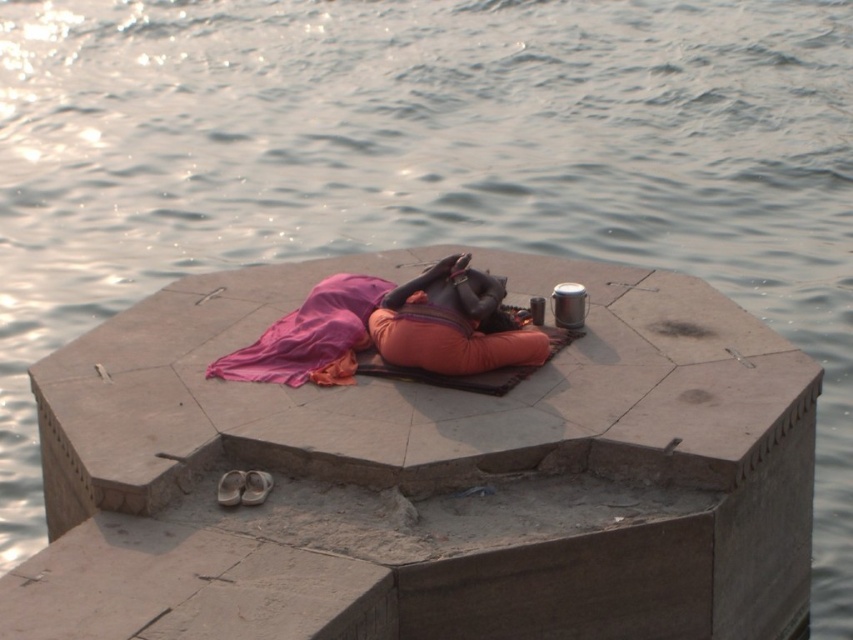
Question: Where is orange fabric at center located in relation to pink fabric at center in the image?

Choices:
 (A) below
 (B) above

Answer: (B)

Question: Is orange fabric at center positioned in front of pink fabric at center?

Choices:
 (A) no
 (B) yes

Answer: (B)

Question: Which of the following is the farthest from the observer?

Choices:
 (A) pink fabric at center
 (B) orange fabric at center

Answer: (A)

Question: Where is orange fabric at center located in relation to pink fabric at center in the image?

Choices:
 (A) above
 (B) below

Answer: (A)